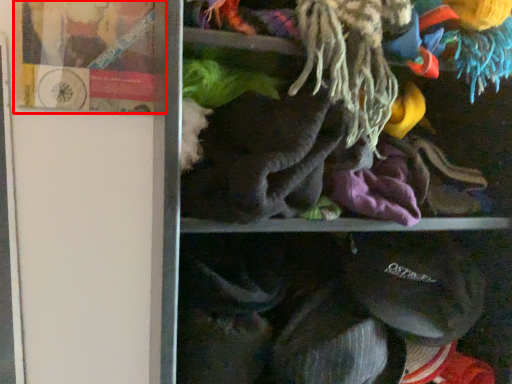
Question: From the image's perspective, what is the correct spatial positioning of book (annotated by the red box) in reference to laundry?

Choices:
 (A) below
 (B) above

Answer: (B)